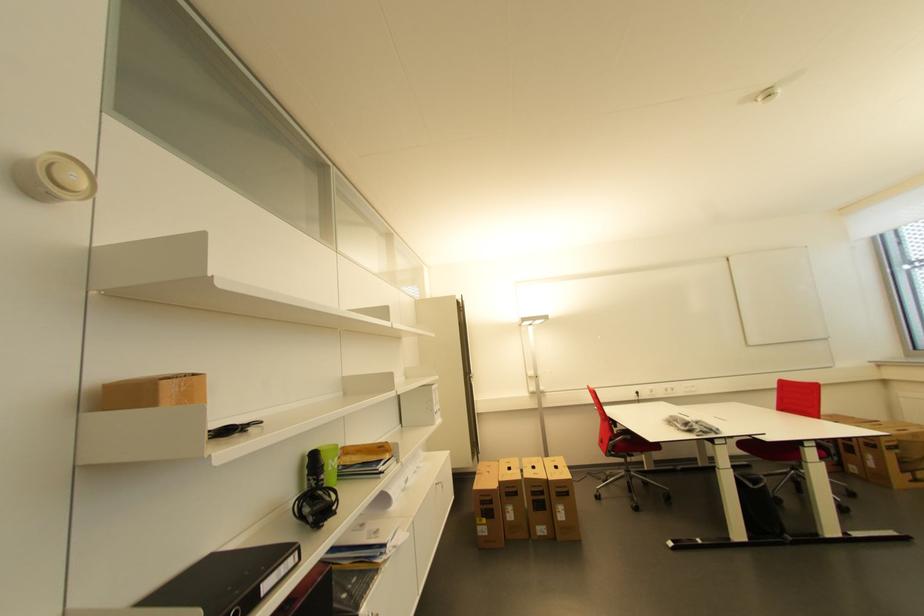
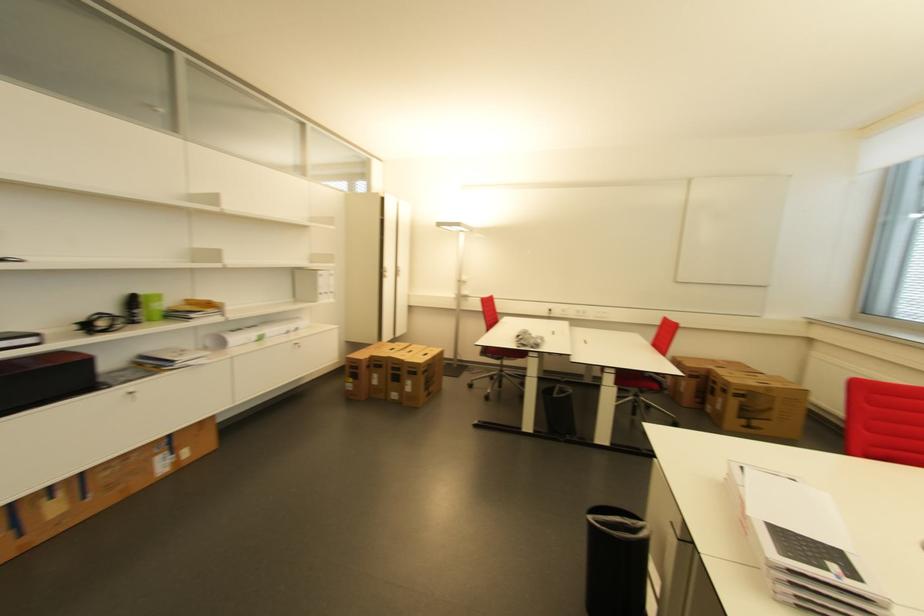
In the second image, find the point that corresponds to (327,459) in the first image.

(147, 301)